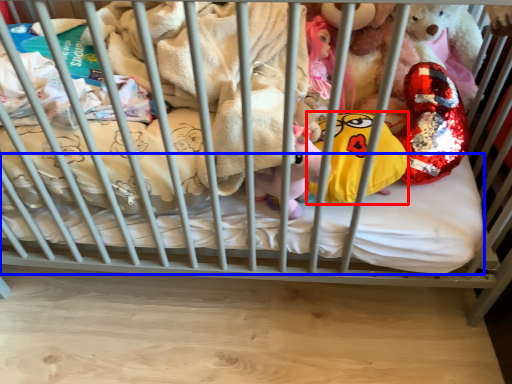
Question: Which point is closer to the camera, pillow (highlighted by a red box) or mattress (highlighted by a blue box)?

Choices:
 (A) pillow
 (B) mattress

Answer: (A)